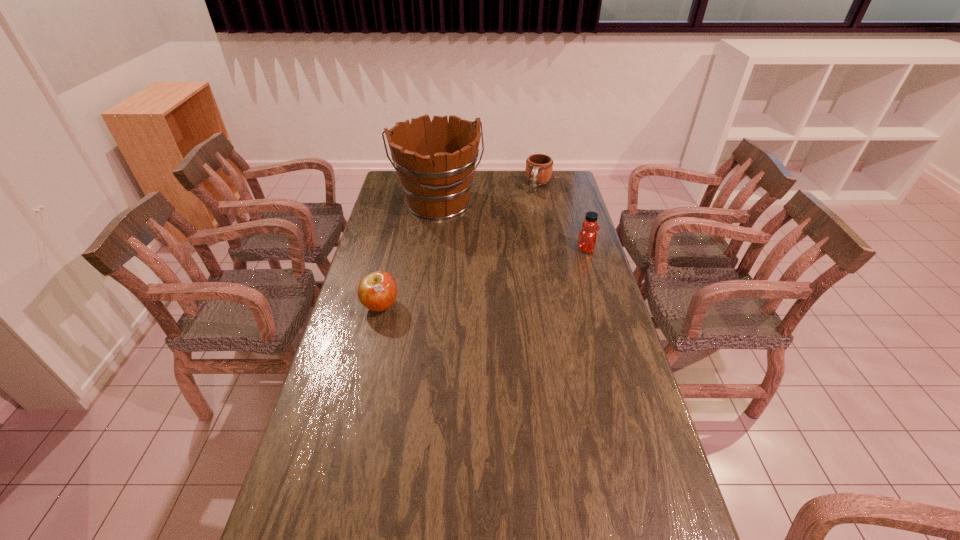
I want to click on vacant space located on the side of the third object from left to right with the handle, so click(x=533, y=204).

What are the coordinates of `blank space located 0.370m on the side of the third object from left to right with the handle` in the screenshot? It's located at (518, 239).

Find the location of a particular element. wine bucket at the far edge is located at coordinates (435, 161).

This screenshot has height=540, width=960. I want to click on mug situated at the far edge, so click(539, 167).

Locate an element on the screen. The image size is (960, 540). apple at the left edge is located at coordinates (377, 291).

Locate an element on the screen. The height and width of the screenshot is (540, 960). wine bucket that is at the left edge is located at coordinates (435, 161).

Image resolution: width=960 pixels, height=540 pixels. What are the coordinates of `honey that is at the right edge` in the screenshot? It's located at (587, 238).

Image resolution: width=960 pixels, height=540 pixels. Identify the location of mug that is at the right edge. (539, 167).

Find the location of a particular element. object at the far left corner is located at coordinates (435, 161).

Locate an element on the screen. object at the far right corner is located at coordinates (539, 167).